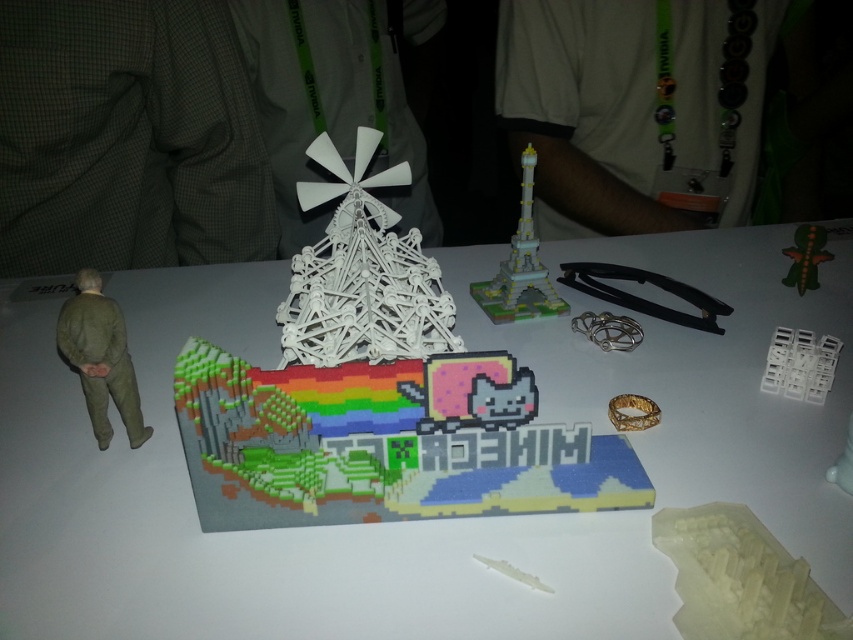
Question: Is the position of matte plastic pixel art at center more distant than that of green matte figure at left?

Choices:
 (A) yes
 (B) no

Answer: (B)

Question: Which of the following is the closest to the observer?

Choices:
 (A) green matte figure at left
 (B) matte plastic pixel art at center

Answer: (B)

Question: Where is matte plastic pixel art at center located in relation to green matte figure at left in the image?

Choices:
 (A) below
 (B) above

Answer: (B)

Question: Which of the following is the farthest from the observer?

Choices:
 (A) green matte figure at left
 (B) matte plastic pixel art at center

Answer: (A)

Question: Which of the following is the farthest from the observer?

Choices:
 (A) (82, 269)
 (B) (718, 353)

Answer: (B)

Question: Does matte plastic pixel art at center have a greater width compared to green matte figure at left?

Choices:
 (A) yes
 (B) no

Answer: (A)